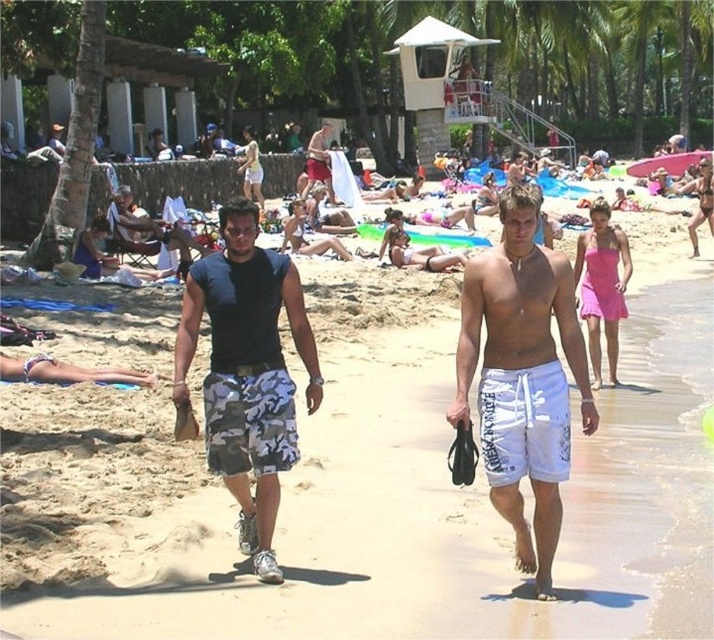
Which is in front, point (486, 266) or point (326, 161)?

Point (486, 266) is in front.

What do you see at coordinates (522, 376) in the screenshot? I see `white cotton shorts at center` at bounding box center [522, 376].

Between point (491, 291) and point (318, 129), which one is positioned behind?

Point (318, 129)

Where is `white cotton shorts at center`? white cotton shorts at center is located at coordinates (522, 376).

Does white cotton shorts at center have a lesser width compared to camo fabric shorts at center?

Yes, white cotton shorts at center is thinner than camo fabric shorts at center.

Which is in front, point (518, 348) or point (183, 403)?

Point (518, 348) is more forward.

Between point (548, 488) and point (248, 339), which one is positioned behind?

The point (248, 339) is behind.

In order to click on white cotton shorts at center in this screenshot , I will do `click(522, 376)`.

Between camo fabric shorts at center and camouflage shorts at center, which one is positioned lower?

Positioned lower is camo fabric shorts at center.

Which is behind, point (233, 420) or point (326, 138)?

The point (326, 138) is more distant.

Where is `camo fabric shorts at center`? The width and height of the screenshot is (714, 640). camo fabric shorts at center is located at coordinates (246, 371).

Find the location of a particular element. camo fabric shorts at center is located at coordinates (246, 371).